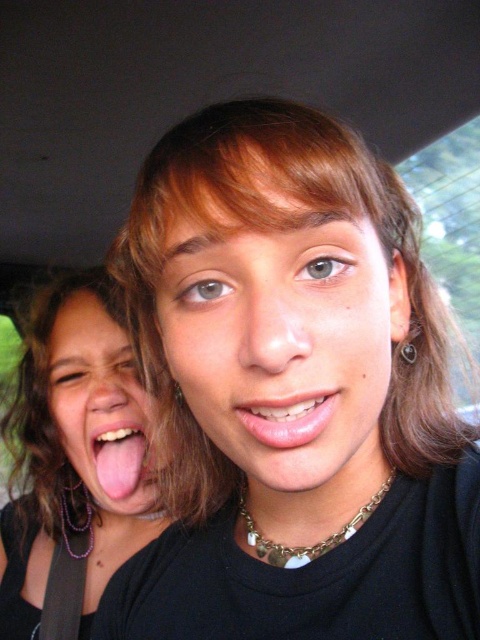
Consider the image. Does matte black hair at center appear under matte skin face at lower left?

No.

Does matte black hair at center have a larger size compared to matte skin face at lower left?

Indeed, matte black hair at center has a larger size compared to matte skin face at lower left.

Is point (336, 314) in front of point (87, 372)?

Yes, point (336, 314) is in front of point (87, 372).

Image resolution: width=480 pixels, height=640 pixels. Identify the location of matte black hair at center. [292, 392].

Based on the photo, who is higher up, matte black hair at center or matte black hair at left?

Positioned higher is matte black hair at center.

Describe the element at coordinates (292, 392) in the screenshot. I see `matte black hair at center` at that location.

Is point (179, 563) positioned in front of point (1, 636)?

That is True.

The height and width of the screenshot is (640, 480). In order to click on matte black hair at center in this screenshot , I will do `click(292, 392)`.

Can you confirm if smooth skin face at center is wider than pink glossy tongue at lower left?

Correct, the width of smooth skin face at center exceeds that of pink glossy tongue at lower left.

Describe the element at coordinates (282, 337) in the screenshot. I see `smooth skin face at center` at that location.

Locate an element on the screen. Image resolution: width=480 pixels, height=640 pixels. smooth skin face at center is located at coordinates (282, 337).